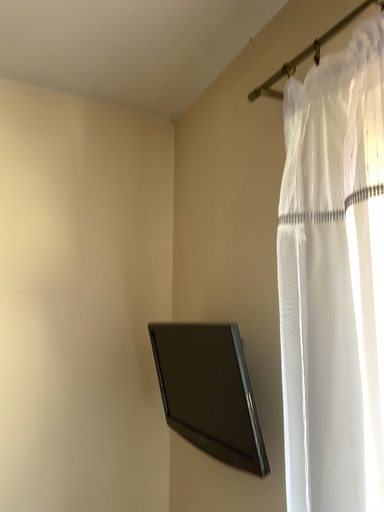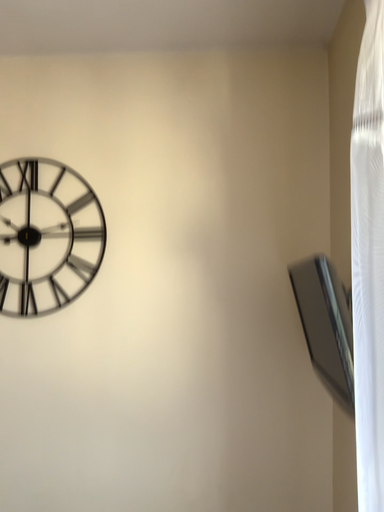
Question: Which way did the camera rotate in the video?

Choices:
 (A) rotated downward
 (B) rotated upward

Answer: (A)